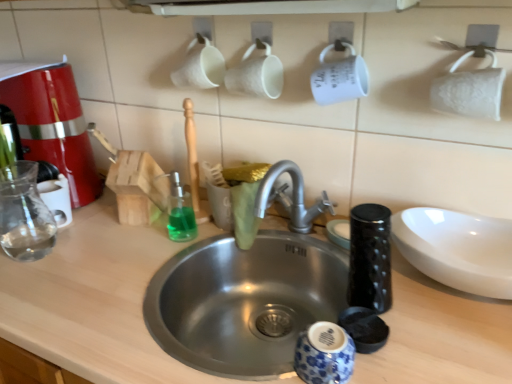
Question: Is matte red coffee machine at left smaller than stainless steel sink at center?

Choices:
 (A) no
 (B) yes

Answer: (A)

Question: Is the position of matte red coffee machine at left more distant than that of stainless steel sink at center?

Choices:
 (A) no
 (B) yes

Answer: (B)

Question: From a real-world perspective, is matte red coffee machine at left beneath stainless steel sink at center?

Choices:
 (A) no
 (B) yes

Answer: (A)

Question: Does matte red coffee machine at left appear on the right side of stainless steel sink at center?

Choices:
 (A) no
 (B) yes

Answer: (A)

Question: Is the position of matte red coffee machine at left less distant than that of stainless steel sink at center?

Choices:
 (A) no
 (B) yes

Answer: (A)

Question: From a real-world perspective, is stainless steel sink at center physically located above or below white lace toilet paper at upper right?

Choices:
 (A) below
 (B) above

Answer: (A)

Question: From the image's perspective, relative to white lace toilet paper at upper right, is stainless steel sink at center above or below?

Choices:
 (A) below
 (B) above

Answer: (A)

Question: Visually, is stainless steel sink at center positioned to the left or to the right of white lace toilet paper at upper right?

Choices:
 (A) right
 (B) left

Answer: (B)

Question: Relative to white lace toilet paper at upper right, is stainless steel sink at center in front or behind?

Choices:
 (A) behind
 (B) front

Answer: (B)

Question: Considering the positions of matte red coffee machine at left and stainless steel sink at center in the image, is matte red coffee machine at left bigger or smaller than stainless steel sink at center?

Choices:
 (A) big
 (B) small

Answer: (B)

Question: In the image, is matte red coffee machine at left positioned in front of or behind stainless steel sink at center?

Choices:
 (A) front
 (B) behind

Answer: (B)

Question: In terms of width, does matte red coffee machine at left look wider or thinner when compared to stainless steel sink at center?

Choices:
 (A) wide
 (B) thin

Answer: (B)

Question: Does point (20, 132) appear closer or farther from the camera than point (96, 301)?

Choices:
 (A) closer
 (B) farther

Answer: (B)

Question: Relative to matte red coffee machine at left, is stainless steel sink at center in front or behind?

Choices:
 (A) behind
 (B) front

Answer: (B)

Question: Looking at the image, does stainless steel sink at center seem bigger or smaller compared to matte red coffee machine at left?

Choices:
 (A) big
 (B) small

Answer: (A)